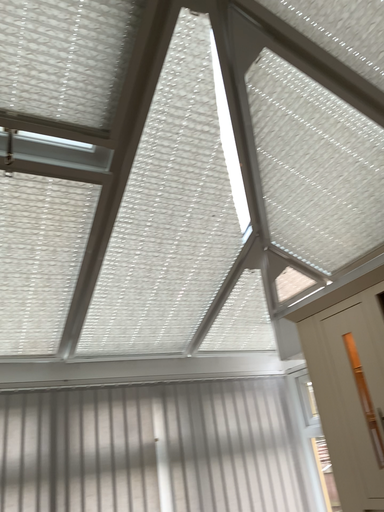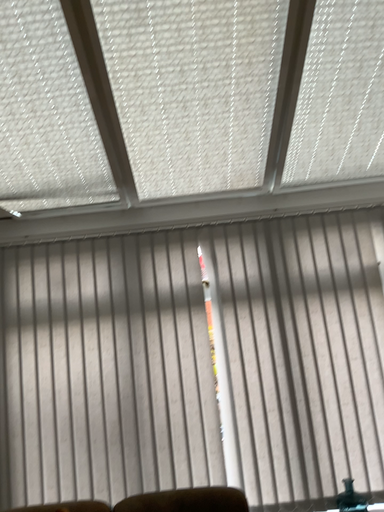
Question: How did the camera likely rotate when shooting the video?

Choices:
 (A) rotated upward
 (B) rotated downward

Answer: (B)